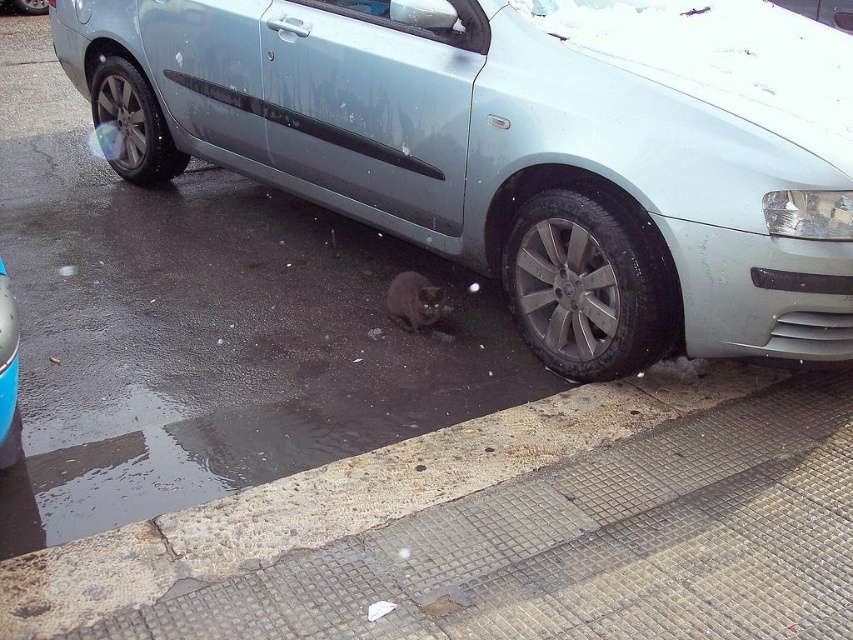
Question: Considering the real-world distances, which object is closest to the black rubber tire at lower right?

Choices:
 (A) gray fur cat at lower center
 (B) black rubber tire at lower left
 (C) metallic silver car at lower left
 (D) concrete textured curb at lower left

Answer: (D)

Question: Which object appears closest to the camera in this image?

Choices:
 (A) black rubber tire at lower left
 (B) gray fur cat at lower center
 (C) concrete textured curb at lower left

Answer: (C)

Question: Which of the following is the closest to the observer?

Choices:
 (A) (225, 128)
 (B) (119, 68)
 (C) (440, 298)
 (D) (4, 342)

Answer: (D)

Question: Is the position of slate metallic car at center less distant than that of gray fur cat at lower center?

Choices:
 (A) yes
 (B) no

Answer: (A)

Question: Can you confirm if slate metallic car at center is smaller than metallic silver car at lower left?

Choices:
 (A) no
 (B) yes

Answer: (A)

Question: Is black rubber tire at lower right in front of gray fur cat at lower center?

Choices:
 (A) yes
 (B) no

Answer: (A)